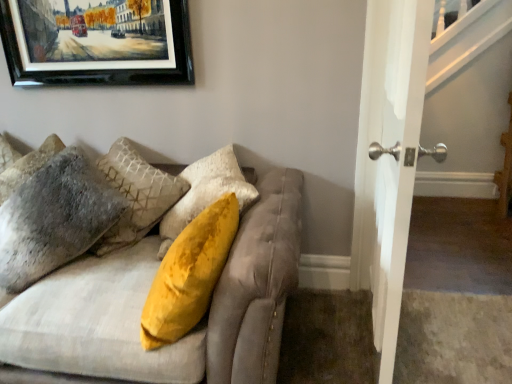
Question: From the image's perspective, is velvet beige couch at upper left located beneath fuzzy gray pillow at left, marked as the 2th pillow in a left-to-right arrangement?

Choices:
 (A) yes
 (B) no

Answer: (A)

Question: Is velvet beige couch at upper left looking in the opposite direction of fuzzy gray pillow at left, marked as the 2th pillow in a left-to-right arrangement?

Choices:
 (A) no
 (B) yes

Answer: (B)

Question: Is velvet beige couch at upper left bigger than fuzzy gray pillow at left, marked as the 2th pillow in a left-to-right arrangement?

Choices:
 (A) no
 (B) yes

Answer: (B)

Question: Considering the relative sizes of velvet beige couch at upper left and fuzzy gray pillow at left, the 1th pillow viewed from the right, in the image provided, is velvet beige couch at upper left wider than fuzzy gray pillow at left, the 1th pillow viewed from the right,?

Choices:
 (A) yes
 (B) no

Answer: (A)

Question: Can you confirm if velvet beige couch at upper left is thinner than fuzzy gray pillow at left, the 1th pillow viewed from the right?

Choices:
 (A) no
 (B) yes

Answer: (A)

Question: Is fuzzy gray pillow at left, the 1th pillow viewed from the right, to the left or to the right of black matte picture frame at upper left in the image?

Choices:
 (A) left
 (B) right

Answer: (A)

Question: Is point (30, 268) closer or farther from the camera than point (102, 64)?

Choices:
 (A) closer
 (B) farther

Answer: (A)

Question: From the image's perspective, is fuzzy gray pillow at left, the 1th pillow viewed from the right, above or below black matte picture frame at upper left?

Choices:
 (A) below
 (B) above

Answer: (A)

Question: Choose the correct answer: Is fuzzy gray pillow at left, the 1th pillow viewed from the right, inside black matte picture frame at upper left or outside it?

Choices:
 (A) outside
 (B) inside

Answer: (A)

Question: In terms of height, does velvet beige couch at upper left look taller or shorter compared to black matte picture frame at upper left?

Choices:
 (A) short
 (B) tall

Answer: (B)

Question: From a real-world perspective, is velvet beige couch at upper left positioned above or below black matte picture frame at upper left?

Choices:
 (A) below
 (B) above

Answer: (A)

Question: Considering the relative positions of velvet beige couch at upper left and black matte picture frame at upper left in the image provided, is velvet beige couch at upper left to the left or to the right of black matte picture frame at upper left?

Choices:
 (A) right
 (B) left

Answer: (A)

Question: In terms of size, does velvet beige couch at upper left appear bigger or smaller than black matte picture frame at upper left?

Choices:
 (A) big
 (B) small

Answer: (A)

Question: In terms of size, does fuzzy gray pillow at left, placed as the 1th pillow when sorted from left to right, appear bigger or smaller than velvet beige couch at upper left?

Choices:
 (A) small
 (B) big

Answer: (A)

Question: From the image's perspective, is fuzzy gray pillow at left, placed as the 1th pillow when sorted from left to right, positioned above or below velvet beige couch at upper left?

Choices:
 (A) above
 (B) below

Answer: (A)